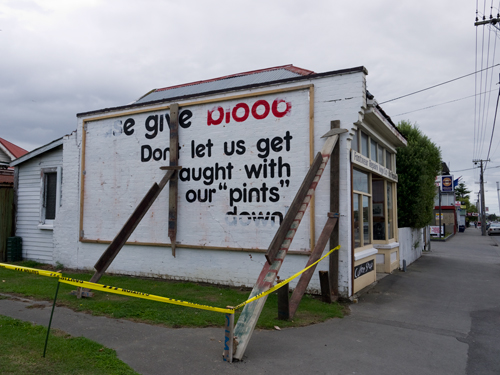
You are a GUI agent. You are given a task and a screenshot of the screen. Output one action in this format:
    pyautogui.click(x=<x>, y=<y>)
    Task: Click on the window
    
    Given the screenshot: What is the action you would take?
    pyautogui.click(x=364, y=219), pyautogui.click(x=354, y=219), pyautogui.click(x=357, y=179), pyautogui.click(x=376, y=189), pyautogui.click(x=379, y=156), pyautogui.click(x=370, y=148), pyautogui.click(x=361, y=146), pyautogui.click(x=51, y=193)